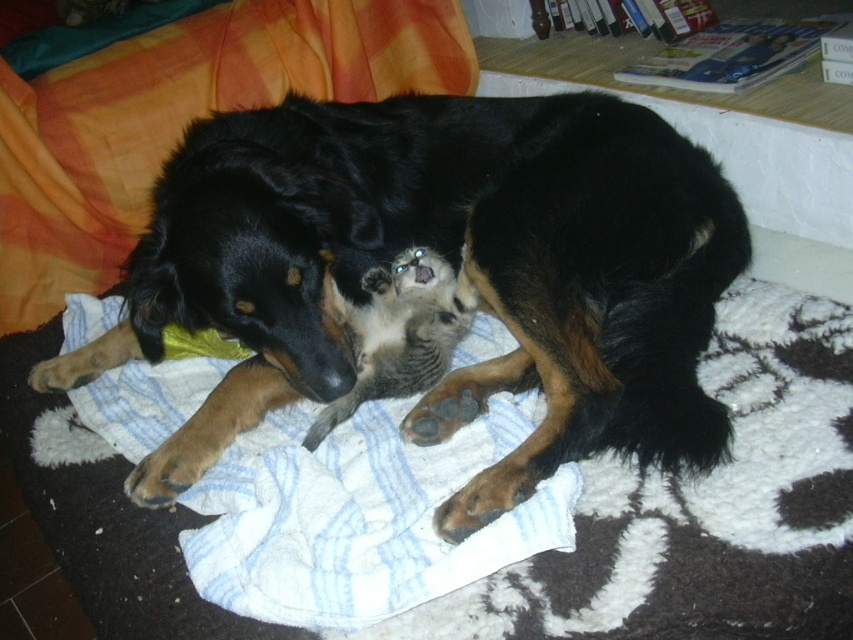
Question: Is white soft dog bed at center to the right of white striped towel at center from the viewer's perspective?

Choices:
 (A) no
 (B) yes

Answer: (B)

Question: Which point is closer to the camera?

Choices:
 (A) pos(750,497)
 (B) pos(286,8)

Answer: (A)

Question: Which of the following is the farthest from the observer?

Choices:
 (A) black fur dog at center
 (B) white striped towel at center
 (C) white soft dog bed at center

Answer: (B)

Question: Among these objects, which one is nearest to the camera?

Choices:
 (A) black fur dog at center
 (B) white striped towel at center

Answer: (A)

Question: Does black fur dog at center appear over white striped towel at center?

Choices:
 (A) no
 (B) yes

Answer: (A)

Question: Does black fur dog at center lie behind white soft dog bed at center?

Choices:
 (A) no
 (B) yes

Answer: (B)